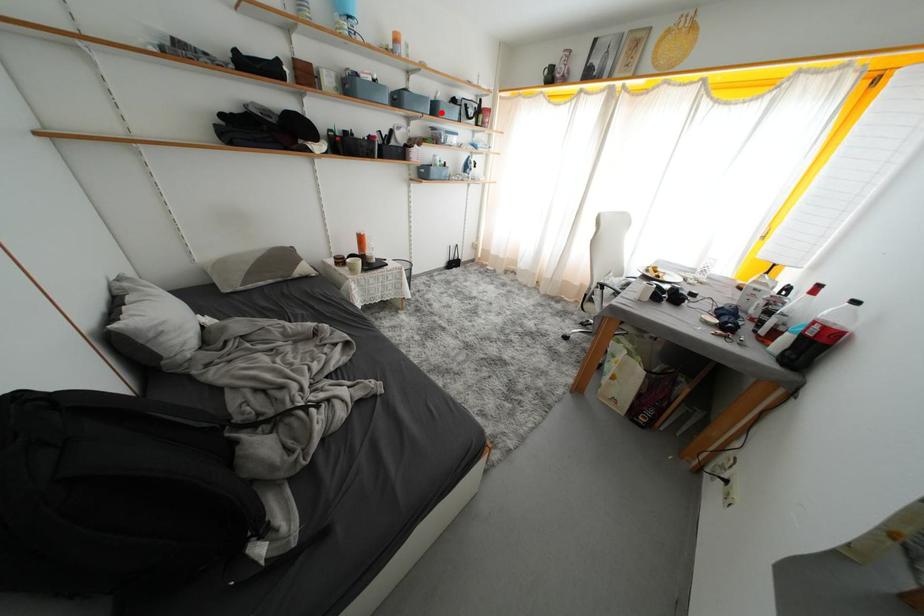
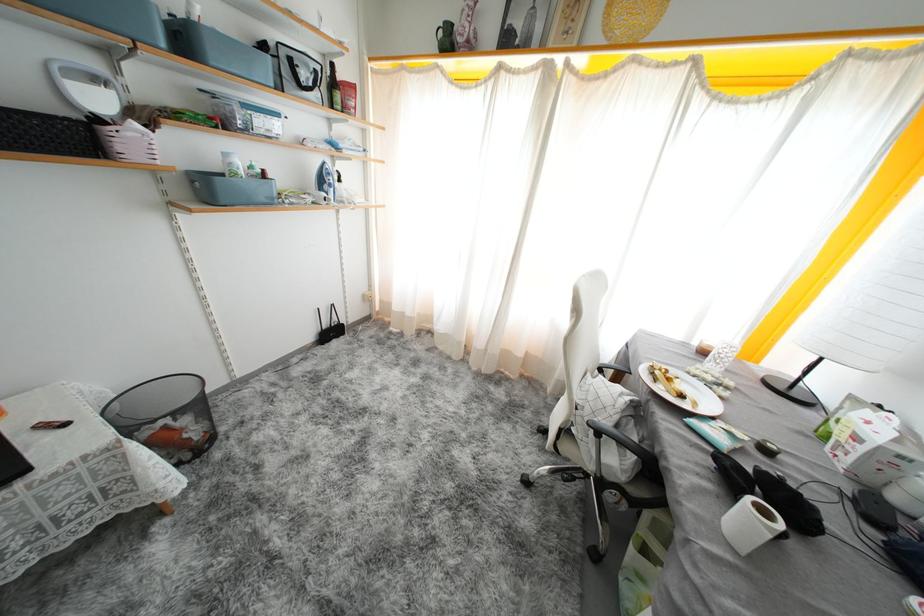
Locate, in the second image, the point that corresponds to the highlighted location in the first image.

(190, 44)